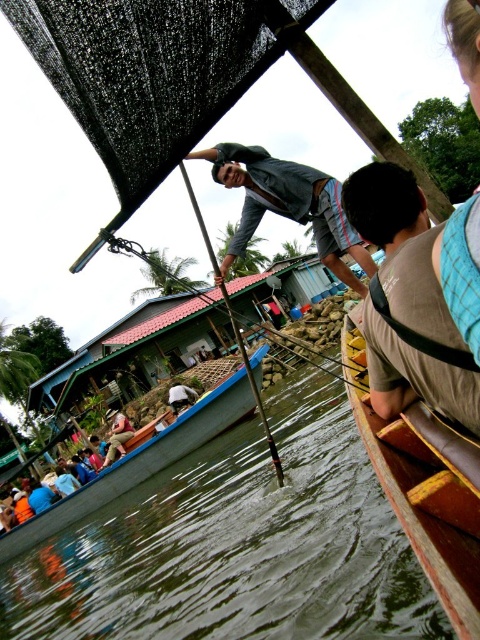
You are planning to rent a boat to cross the river. The wooden canoe at center and the light brown wooden boat at lower left are available. Which one is shorter and thus easier to maneuver in narrow river sections?

The wooden canoe at center is shorter than the light brown wooden boat at lower left, making it easier to maneuver in narrow river sections.

From the picture: You are a tourist standing on the dock and want to take a photo of the wooden pole at center and the dark gray fabric shirt at center. Which object should you focus on first if you want to capture both in the same frame without moving the camera?

The wooden pole at center is taller than the dark gray fabric shirt at center, so you should focus on the wooden pole at center first to ensure both are in frame.